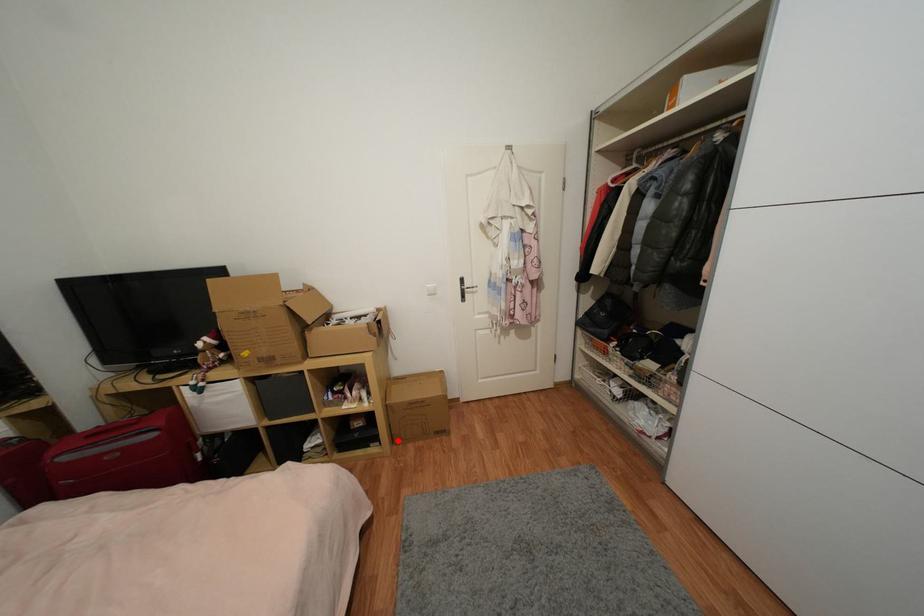
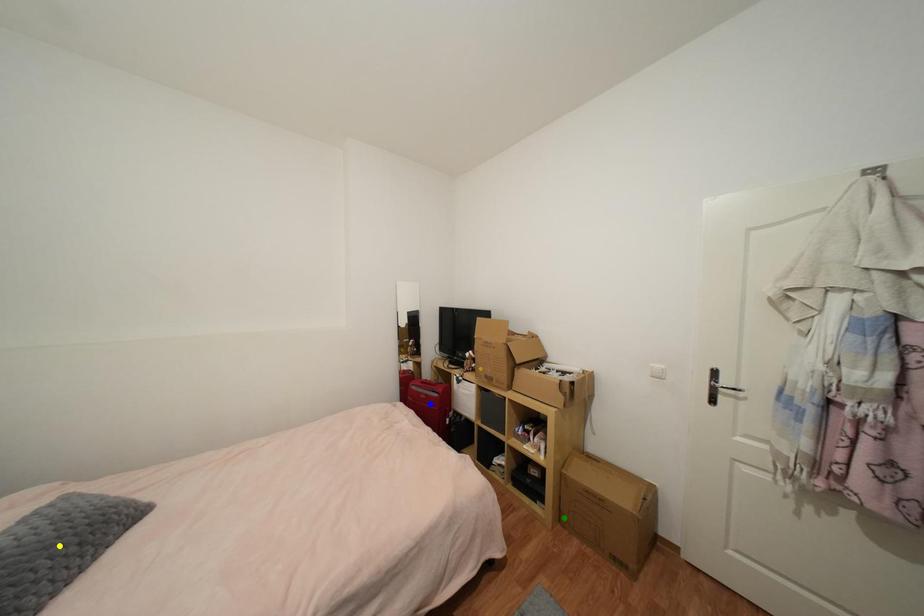
Question: I am providing you with two images of the same scene from different viewpoints. A red point is marked on the first image. You are given multiple points on the second image. Which mark in image 2 goes with the point in image 1?

Choices:
 (A) green point
 (B) yellow point
 (C) blue point

Answer: (A)